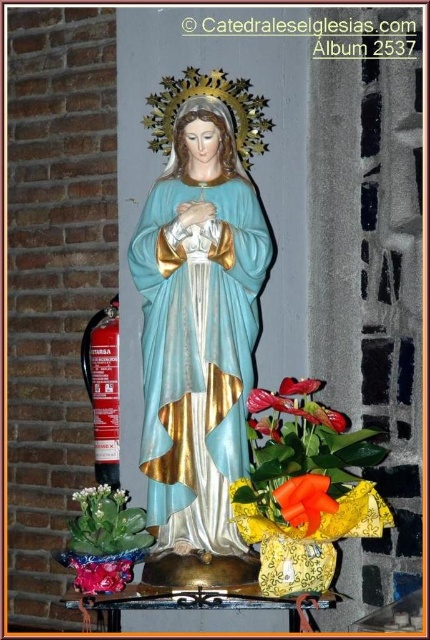
Can you confirm if matte blue fabric statue at center is positioned above matte green succulent at lower left?

Indeed, matte blue fabric statue at center is positioned over matte green succulent at lower left.

Is matte blue fabric statue at center shorter than matte green succulent at lower left?

In fact, matte blue fabric statue at center may be taller than matte green succulent at lower left.

Measure the distance between point (177, 360) and camera.

Point (177, 360) is 1.42 meters from camera.

This screenshot has height=640, width=430. In order to click on matte blue fabric statue at center in this screenshot , I will do `click(197, 330)`.

Who is positioned more to the right, matte blue fabric statue at center or matte orange flower at center?

From the viewer's perspective, matte orange flower at center appears more on the right side.

Measure the distance between matte blue fabric statue at center and camera.

matte blue fabric statue at center and camera are 4.62 feet apart from each other.

At what (x,y) coordinates should I click in order to perform the action: click on matte blue fabric statue at center. Please return your answer as a coordinate pair (x, y). The height and width of the screenshot is (640, 430). Looking at the image, I should click on (197, 330).

Does matte green succulent at lower left come behind matte pink petals at lower left?

Yes, it is behind matte pink petals at lower left.

Looking at this image, is matte green succulent at lower left to the left of matte pink petals at lower left from the viewer's perspective?

Indeed, matte green succulent at lower left is positioned on the left side of matte pink petals at lower left.

In order to click on matte green succulent at lower left in this screenshot , I will do `click(104, 540)`.